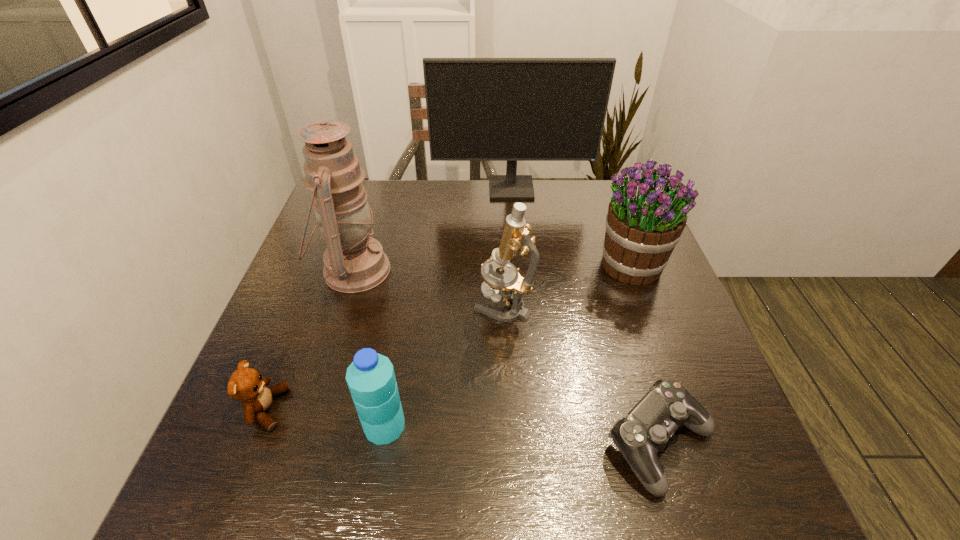
Image resolution: width=960 pixels, height=540 pixels. In the image, there is a desktop. What are the coordinates of `free region at the near right corner` in the screenshot? It's located at (738, 468).

This screenshot has width=960, height=540. In order to click on free space between the microscope and the bouquet in this screenshot , I will do `click(566, 285)`.

In order to click on unoccupied area between the control and the microscope in this screenshot , I will do 582,374.

You are a GUI agent. You are given a task and a screenshot of the screen. Output one action in this format:
    pyautogui.click(x=<x>, y=<y>)
    Task: Click on the empty space that is in between the control and the oil lamp
    This screenshot has width=960, height=540.
    Given the screenshot: What is the action you would take?
    pyautogui.click(x=507, y=357)

At what (x,y) coordinates should I click in order to perform the action: click on vacant space that is in between the second shortest object and the fifth tallest object. Please return your answer as a coordinate pair (x, y). The height and width of the screenshot is (540, 960). Looking at the image, I should click on (325, 417).

Where is `free area in between the water bottle and the microscope`? Image resolution: width=960 pixels, height=540 pixels. free area in between the water bottle and the microscope is located at coordinates (444, 365).

This screenshot has height=540, width=960. Identify the location of vacant area that lies between the water bottle and the shortest object. (522, 435).

Where is `unoccupied area between the second shortest object and the farthest object`? This screenshot has width=960, height=540. unoccupied area between the second shortest object and the farthest object is located at coordinates (389, 299).

The image size is (960, 540). Identify the location of blank region between the third shortest object and the microscope. (444, 365).

Select which object is the second closest to the teddy bear. Please provide its 2D coordinates. Your answer should be formatted as a tuple, i.e. [(x, y)], where the tuple contains the x and y coordinates of a point satisfying the conditions above.

[(354, 262)]